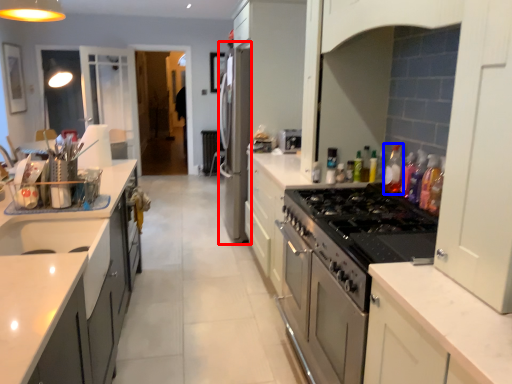
Question: Which point is closer to the camera, appliance (highlighted by a red box) or bottle (highlighted by a blue box)?

Choices:
 (A) appliance
 (B) bottle

Answer: (B)